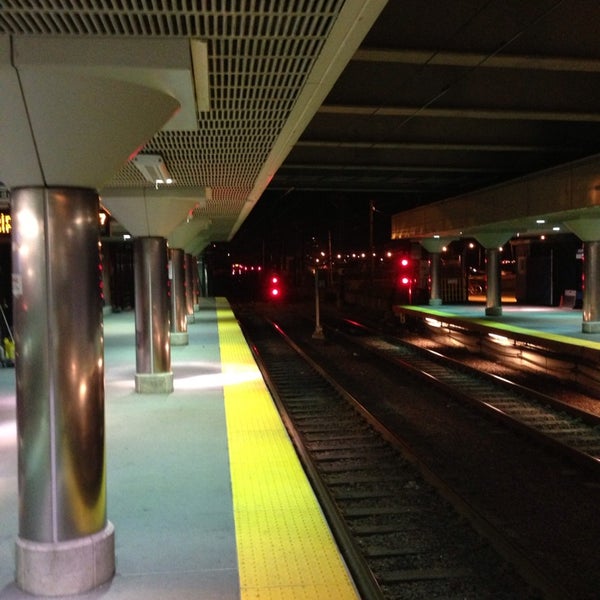
You are a GUI agent. You are given a task and a screenshot of the screen. Output one action in this format:
    pyautogui.click(x=<x>, y=<y>)
    Task: Click on the cement floor
    This screenshot has height=600, width=600.
    Given the screenshot: What is the action you would take?
    pyautogui.click(x=169, y=473)